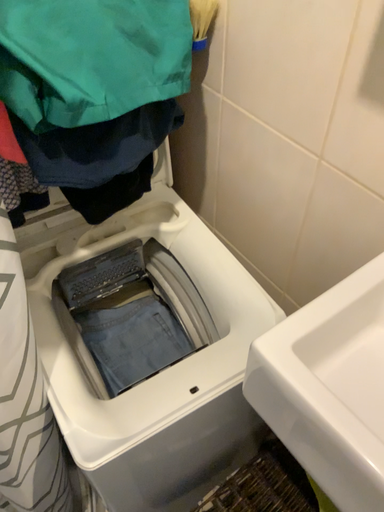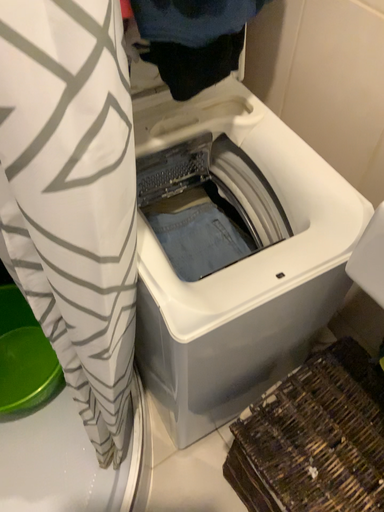
Question: How did the camera likely rotate when shooting the video?

Choices:
 (A) rotated downward
 (B) rotated upward

Answer: (A)